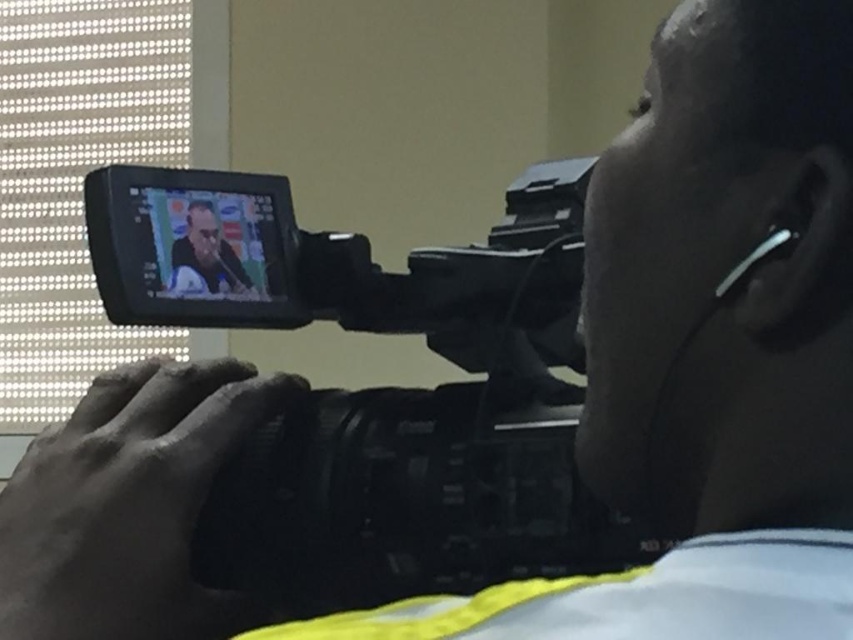
In the scene shown: Who is higher up, black plastic camera at center or matte black laptop at center?

matte black laptop at center is above.

Can you confirm if black plastic camera at center is wider than matte black laptop at center?

Yes, black plastic camera at center is wider than matte black laptop at center.

Is point (361, 316) positioned before point (213, 225)?

No, it is behind (213, 225).

What are the coordinates of `black plastic camera at center` in the screenshot? It's located at (379, 394).